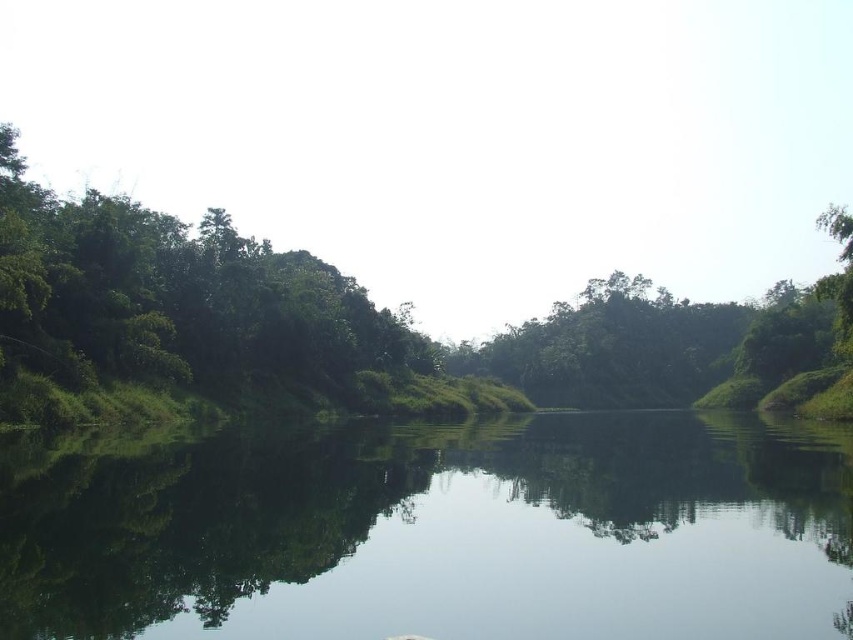
You are standing at the edge of the transparent water at center and want to see the top of the green leafy tree at center. Can you see the top of the tree without moving from your current position?

The transparent water at center is shorter than the green leafy tree at center, so yes, you can see the top of the green leafy tree at center from your current position since the tree is taller than the water.

You are standing at the edge of the transparent water at center and looking towards the green leafy tree at center. Which object is closer to you?

The transparent water at center is closer to you because it is positioned under the green leafy tree at center, meaning the tree is further away.

You are standing at the edge of the water and want to cross to the other side. The water is at center. Is the transparent water at center safe to walk on?

The transparent water at center is safe to walk on because it is calm and reflects the surroundings, indicating it is solid ground.